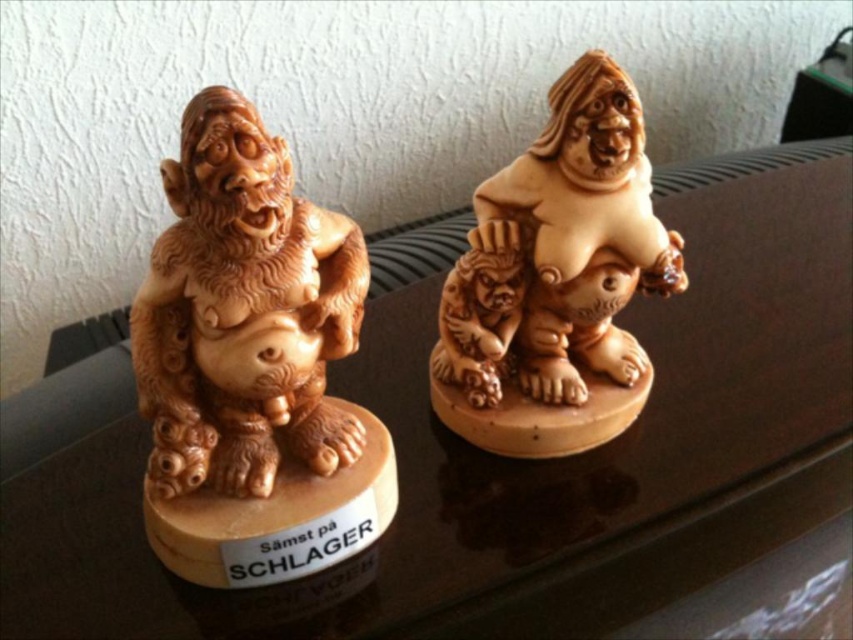
You are organizing a display and want to place a new decorative item between the wooden statue at left and the matte wood statue at center. Is there space available for this item?

The wooden statue at left is to the left of matte wood statue at center, so there is space between them to place the new decorative item.

You are organizing a display of wooden statues and need to ensure proper spacing. The wooden statue at left and the matte wood statue at center are currently placed in a way that might block each other. Which statue is blocking the view of the other?

The wooden statue at left is positioned under the matte wood statue at center, so the matte wood statue at center is blocking the view of the wooden statue at left.

Looking at this image, you are arranging a display and need to know the spatial relationship between the wooden statue at left and the matte wood statue at center. Which one is closer to the viewer?

The wooden statue at left is closer to the viewer than the matte wood statue at center.